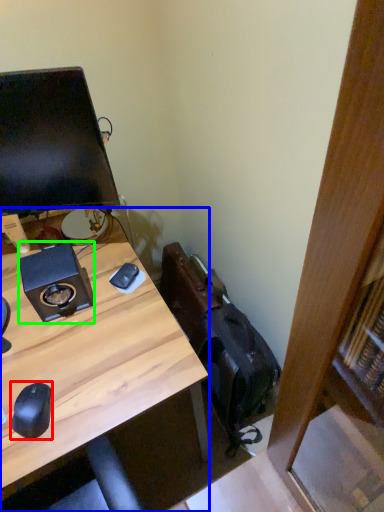
Question: Based on their relative distances, which object is farther from mouse (highlighted by a red box)? Choose from desk (highlighted by a blue box) and speaker (highlighted by a green box).

Choices:
 (A) desk
 (B) speaker

Answer: (B)